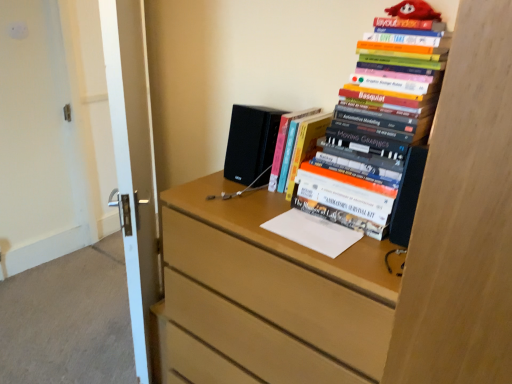
Question: Considering the positions of light wood chest of drawers at center and hardcover book at center, placed as the second book when sorted from right to left, in the image, is light wood chest of drawers at center wider or thinner than hardcover book at center, placed as the second book when sorted from right to left,?

Choices:
 (A) thin
 (B) wide

Answer: (B)

Question: Based on their positions, is light wood chest of drawers at center located to the left or right of hardcover book at center, placed as the second book when sorted from right to left?

Choices:
 (A) left
 (B) right

Answer: (A)

Question: Which object is the closest to the white glossy door at left?

Choices:
 (A) hardcover book at center, placed as the second book when sorted from right to left
 (B) light wood chest of drawers at center
 (C) black matte speaker at center
 (D) hardcover books at upper right, the second book viewed from the left

Answer: (C)

Question: Considering the real-world distances, which object is farthest from the light wood chest of drawers at center?

Choices:
 (A) hardcover books at upper right, the 1th book from the right
 (B) white glossy door at left
 (C) hardcover book at center, placed as the 1th book when sorted from left to right
 (D) black matte speaker at center

Answer: (B)